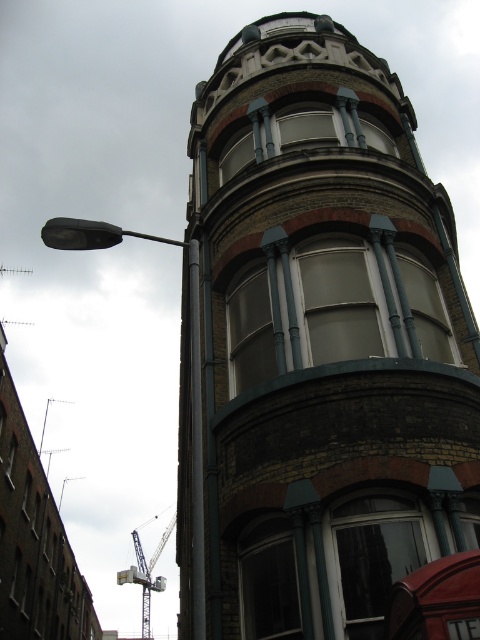
In the scene shown: You are an architect analyzing the building layout. The brown brick tower at upper center is part of a design that needs to be centered precisely. Is the tower positioned at the exact center of the building facade?

The brown brick tower at upper center is located at coordinates (316, 344), which is close to but not exactly the mathematical center of the building facade. The exact center would be at (240, 320), so it is slightly offset to the right and higher up.